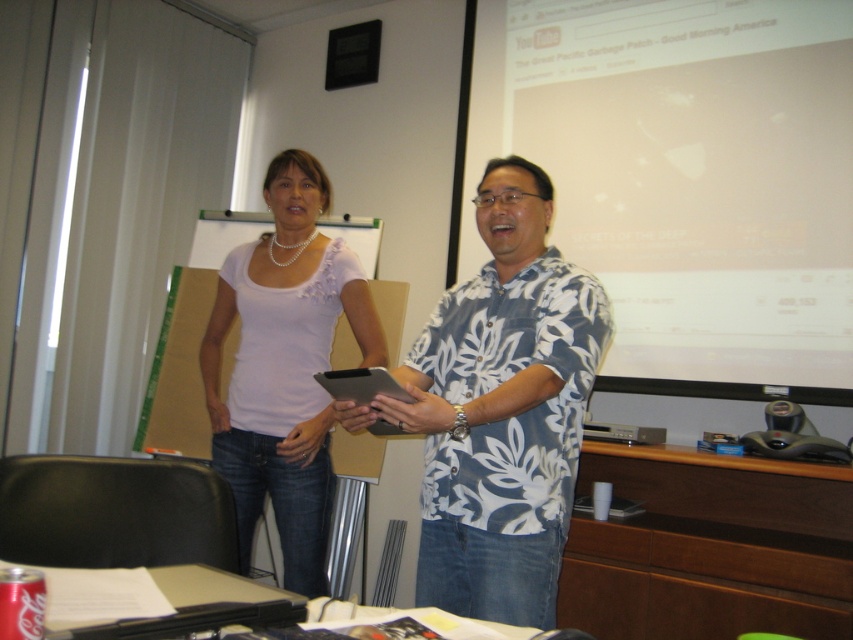
Between white matte projection screen at upper right and white floral shirt at center, which one appears on the right side from the viewer's perspective?

From the viewer's perspective, white matte projection screen at upper right appears more on the right side.

Where is `white matte projection screen at upper right`? Image resolution: width=853 pixels, height=640 pixels. white matte projection screen at upper right is located at coordinates (688, 177).

Is point (651, 321) farther from viewer compared to point (547, 493)?

Yes, it is behind point (547, 493).

Find the location of `white matte projection screen at upper right`. white matte projection screen at upper right is located at coordinates (688, 177).

Is the position of white matte projection screen at upper right less distant than that of matte white blouse at center?

No.

Is white matte projection screen at upper right bigger than matte white blouse at center?

Yes, white matte projection screen at upper right is bigger than matte white blouse at center.

In the scene shown: Measure the distance between white matte projection screen at upper right and camera.

7.52 feet

Where is `white matte projection screen at upper right`? The height and width of the screenshot is (640, 853). white matte projection screen at upper right is located at coordinates (688, 177).

Is white floral shirt at center to the left of matte white blouse at center from the viewer's perspective?

In fact, white floral shirt at center is to the right of matte white blouse at center.

Describe the element at coordinates (498, 410) in the screenshot. I see `white floral shirt at center` at that location.

This screenshot has width=853, height=640. Identify the location of white floral shirt at center. (498, 410).

Where is `white floral shirt at center`? This screenshot has width=853, height=640. white floral shirt at center is located at coordinates (498, 410).